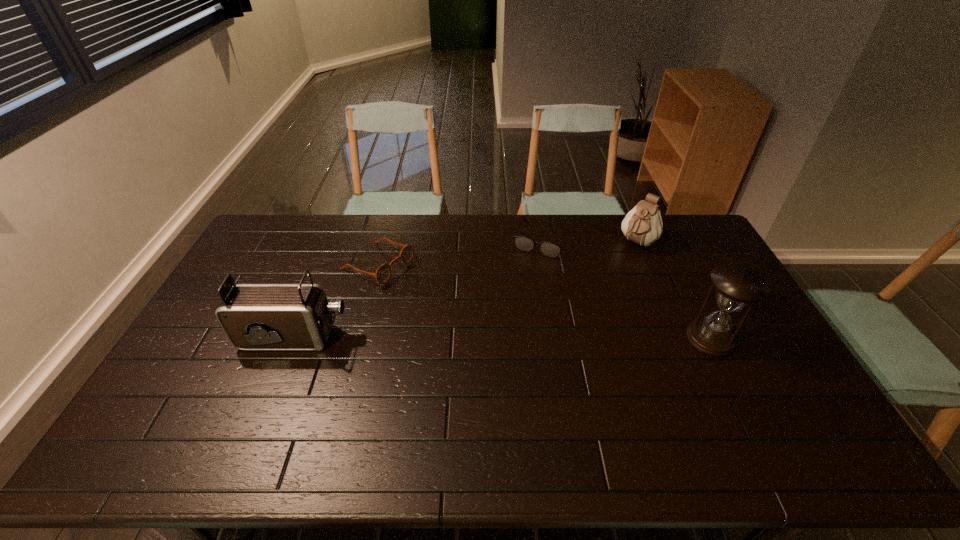
I want to click on vacant spot on the desktop that is between the camcorder and the hourglass and is positioned on the front-facing side of the third object from left to right, so click(497, 338).

This screenshot has height=540, width=960. I want to click on free spot on the desktop that is between the camcorder and the hourglass and is positioned on the front-facing side of the pouch, so click(557, 338).

Where is `free space on the desktop that is between the camcorder and the hourglass and is positioned on the front-facing side of the left spectacles`? free space on the desktop that is between the camcorder and the hourglass and is positioned on the front-facing side of the left spectacles is located at coordinates (536, 338).